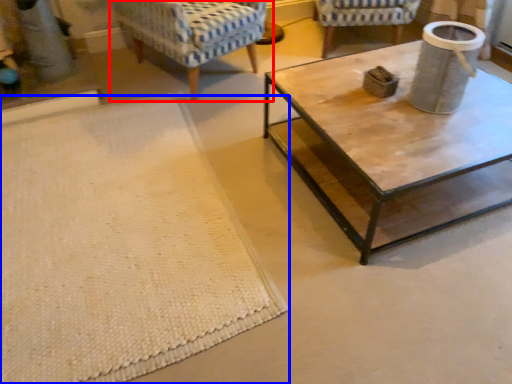
Question: Which point is further to the camera, chair (highlighted by a red box) or mat (highlighted by a blue box)?

Choices:
 (A) chair
 (B) mat

Answer: (A)